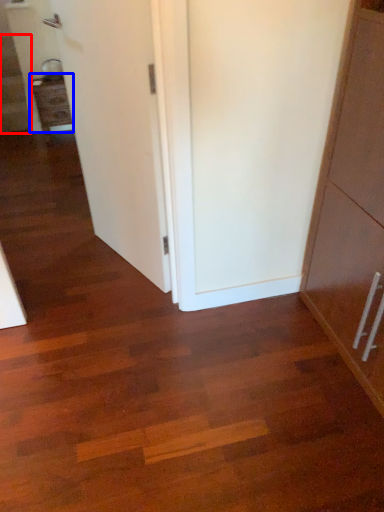
Question: Among these objects, which one is farthest to the camera, stairwell (highlighted by a red box) or cabinetry (highlighted by a blue box)?

Choices:
 (A) stairwell
 (B) cabinetry

Answer: (A)